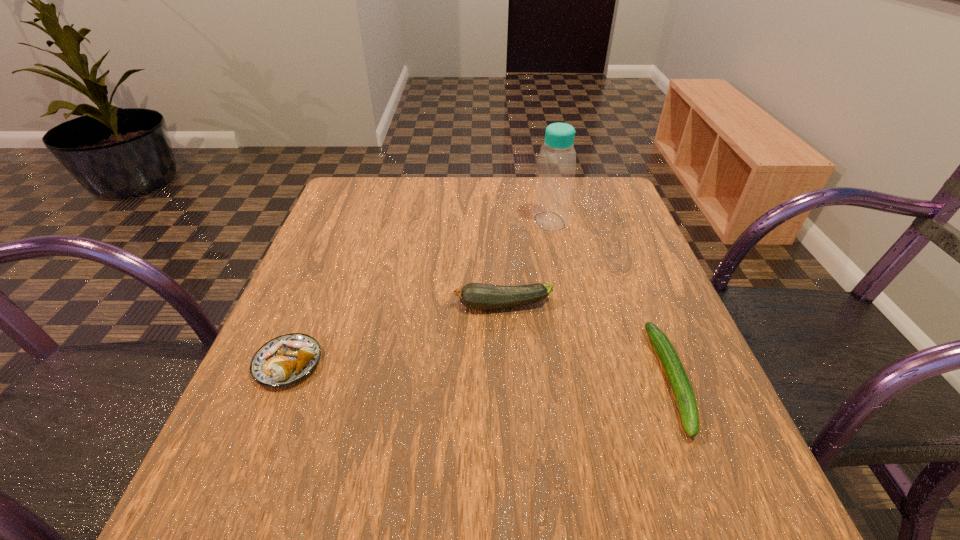
In the image, there is a desktop. Where is `blank space at the right edge`? blank space at the right edge is located at coordinates (602, 250).

Where is `blank area at the far left corner`? The width and height of the screenshot is (960, 540). blank area at the far left corner is located at coordinates (368, 224).

In the image, there is a desktop. At what (x,y) coordinates should I click in order to perform the action: click on vacant area at the near left corner. Please return your answer as a coordinate pair (x, y). The image size is (960, 540). Looking at the image, I should click on (284, 512).

In the image, there is a desktop. At what (x,y) coordinates should I click in order to perform the action: click on vacant area at the far right corner. Please return your answer as a coordinate pair (x, y). Image resolution: width=960 pixels, height=540 pixels. Looking at the image, I should click on (574, 202).

This screenshot has width=960, height=540. What are the coordinates of `free spot between the farther zucchini and the shortest object` in the screenshot? It's located at (587, 342).

Identify the location of vacant space in between the rightmost object and the second shortest object. (480, 372).

Find the location of `free space between the farthest object and the taller zucchini`. free space between the farthest object and the taller zucchini is located at coordinates (526, 264).

Locate an element on the screen. The image size is (960, 540). free space between the second shortest object and the rightmost object is located at coordinates (480, 372).

This screenshot has height=540, width=960. What are the coordinates of `free space between the rightmost object and the pastry` in the screenshot? It's located at (480, 372).

Locate an element on the screen. free point between the pastry and the right zucchini is located at coordinates (480, 372).